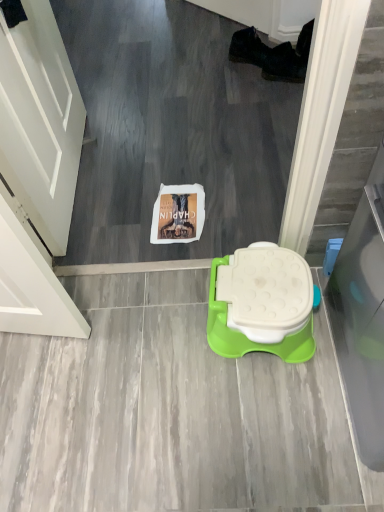
Find the location of `vacant area located to the right-hand side of white matte door at upper left`. vacant area located to the right-hand side of white matte door at upper left is located at coordinates (158, 158).